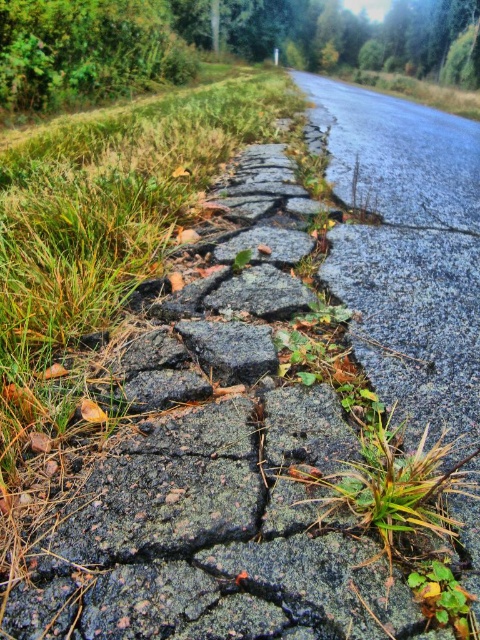
Question: Observing the image, what is the correct spatial positioning of dark gray rough stone at center in reference to green leafy weed at lower right?

Choices:
 (A) above
 (B) below

Answer: (A)

Question: Is dark gray rough stone at center below green leafy weed at lower right?

Choices:
 (A) yes
 (B) no

Answer: (B)

Question: Among these objects, which one is farthest from the camera?

Choices:
 (A) dark gray rough stone at center
 (B) green grass at center

Answer: (A)

Question: Where is dark gray rough stone at center located in relation to green leafy weed at lower right in the image?

Choices:
 (A) below
 (B) above

Answer: (B)

Question: Estimate the real-world distances between objects in this image. Which object is closer to the green grass at center?

Choices:
 (A) green leafy weed at lower right
 (B) dark gray rough stone at center

Answer: (A)

Question: Estimate the real-world distances between objects in this image. Which object is closer to the black rough stone at center?

Choices:
 (A) green grass at center
 (B) green leafy weed at lower right

Answer: (A)